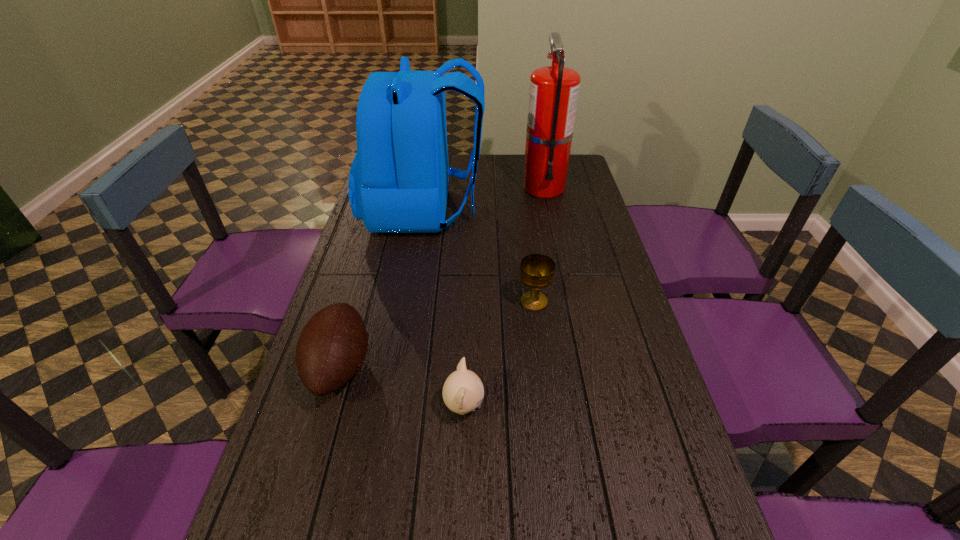
Locate an element on the screen. Image resolution: width=960 pixels, height=540 pixels. blank space that satisfies the following two spatial constraints: 1. at the nozzle of the fire extinguisher; 2. on the face of the kitten is located at coordinates (589, 407).